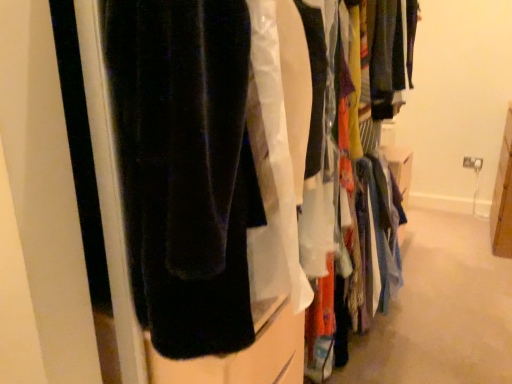
Question: Does light blue fabric at center, acting as the first closet starting from the right, appear on the right side of velvet black pants at left, which is counted as the first closet, starting from the left?

Choices:
 (A) no
 (B) yes

Answer: (B)

Question: Is light blue fabric at center, which is the 2th closet from left to right, far away from velvet black pants at left, marked as the second closet in a right-to-left arrangement?

Choices:
 (A) yes
 (B) no

Answer: (B)

Question: Considering the relative sizes of light blue fabric at center, acting as the first closet starting from the right, and velvet black pants at left, marked as the second closet in a right-to-left arrangement, in the image provided, is light blue fabric at center, acting as the first closet starting from the right, wider than velvet black pants at left, marked as the second closet in a right-to-left arrangement,?

Choices:
 (A) no
 (B) yes

Answer: (A)

Question: Can velvet black pants at left, marked as the second closet in a right-to-left arrangement, be found inside light blue fabric at center, which is the 2th closet from left to right?

Choices:
 (A) no
 (B) yes

Answer: (A)

Question: Is light blue fabric at center, acting as the first closet starting from the right, smaller than velvet black pants at left, marked as the second closet in a right-to-left arrangement?

Choices:
 (A) no
 (B) yes

Answer: (B)

Question: From a real-world perspective, is light blue fabric at center, acting as the first closet starting from the right, on velvet black pants at left, which is counted as the first closet, starting from the left?

Choices:
 (A) no
 (B) yes

Answer: (A)

Question: Is velvet black pants at left, marked as the second closet in a right-to-left arrangement, positioned beyond the bounds of light blue fabric at center, which is the 2th closet from left to right?

Choices:
 (A) yes
 (B) no

Answer: (A)

Question: Is velvet black pants at left, which is counted as the first closet, starting from the left, further to the viewer compared to light blue fabric at center, acting as the first closet starting from the right?

Choices:
 (A) no
 (B) yes

Answer: (A)

Question: Is velvet black pants at left, which is counted as the first closet, starting from the left, wider than light blue fabric at center, which is the 2th closet from left to right?

Choices:
 (A) yes
 (B) no

Answer: (A)

Question: Is velvet black pants at left, marked as the second closet in a right-to-left arrangement, looking in the opposite direction of light blue fabric at center, acting as the first closet starting from the right?

Choices:
 (A) yes
 (B) no

Answer: (A)

Question: Considering the relative sizes of velvet black pants at left, marked as the second closet in a right-to-left arrangement, and light blue fabric at center, acting as the first closet starting from the right, in the image provided, is velvet black pants at left, marked as the second closet in a right-to-left arrangement, smaller than light blue fabric at center, acting as the first closet starting from the right,?

Choices:
 (A) no
 (B) yes

Answer: (A)

Question: From the image's perspective, is velvet black pants at left, which is counted as the first closet, starting from the left, below light blue fabric at center, which is the 2th closet from left to right?

Choices:
 (A) no
 (B) yes

Answer: (A)

Question: In the image, is light blue fabric at center, which is the 2th closet from left to right, on the left side or the right side of velvet black pants at left, which is counted as the first closet, starting from the left?

Choices:
 (A) left
 (B) right

Answer: (B)